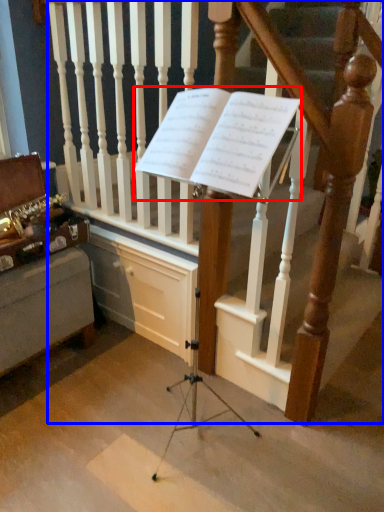
Question: Which point is closer to the camera, sheet music (highlighted by a red box) or stairs (highlighted by a blue box)?

Choices:
 (A) sheet music
 (B) stairs

Answer: (A)